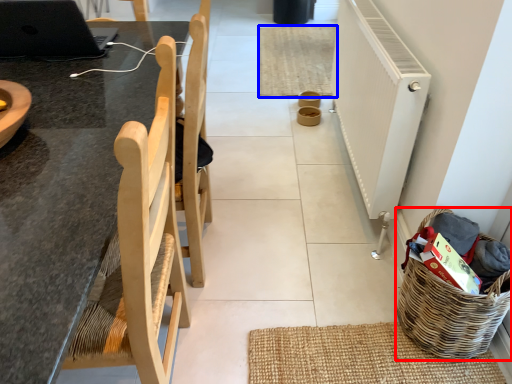
Question: Which object appears farthest to the camera in this image, basket (highlighted by a red box) or mat (highlighted by a blue box)?

Choices:
 (A) basket
 (B) mat

Answer: (B)